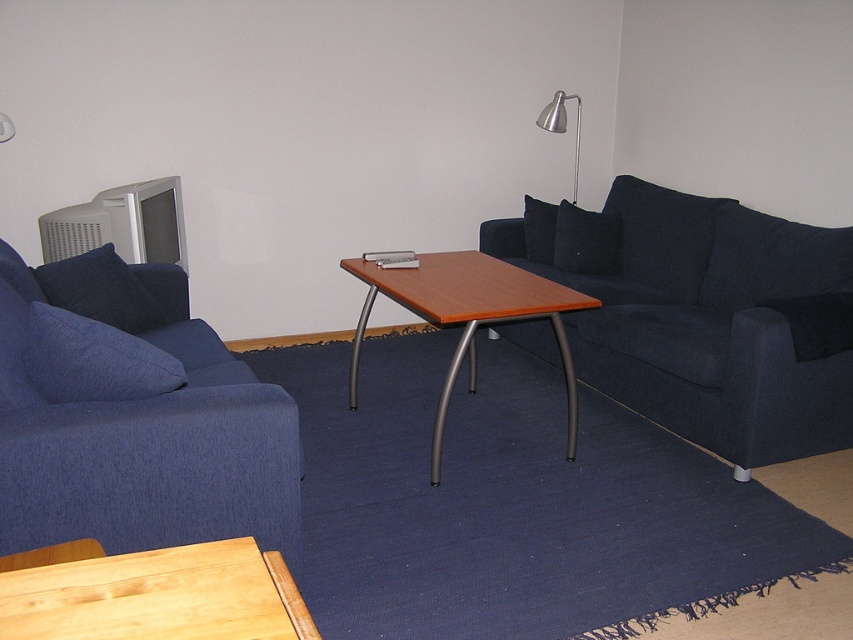
In the scene shown: You are a guest entering the living room and want to place your bag on the nearest table. The dark blue fabric couch at right is in your way. Can you easily move around the couch to reach the light brown wooden table at lower left?

The light brown wooden table at lower left is behind the dark blue fabric couch at right, so you cannot easily reach it without moving the couch. Consider placing your bag on the other table instead.

You are standing at the entrance of the living room and want to move towards the denim blue sofa at left. Based on the coordinates provided, in which direction should you move first?

The denim blue sofa at left is located at coordinates point (132,417). Since the coordinate system is not specified, it is difficult to determine the exact direction to move. However, based on typical coordinate systems where the origin is at the bottom left corner, moving towards the left and slightly upwards might be the correct direction.

You are a delivery person trying to place a large package on the floor. The package is 1.2 meters tall. You see the denim blue sofa at left and the dark blue fabric pillow at upper right. Which object is taller than the package?

The denim blue sofa at left is taller than the dark blue fabric pillow at upper right, but the package is 1.2 meters tall. However, the description does not provide the exact height of the sofa or the pillow, so we cannot determine if either is taller than the package.